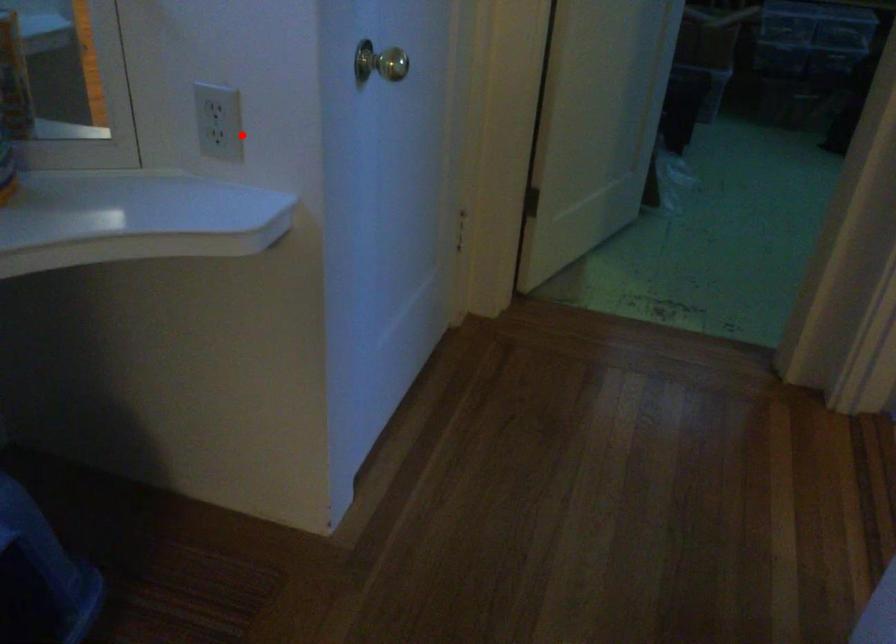
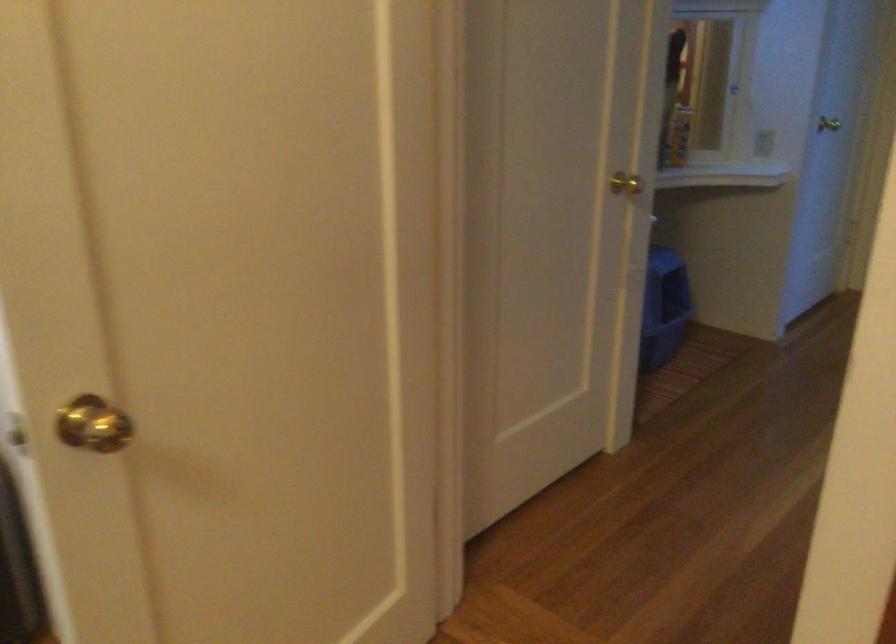
Find the pixel in the second image that matches the highlighted location in the first image.

(762, 143)